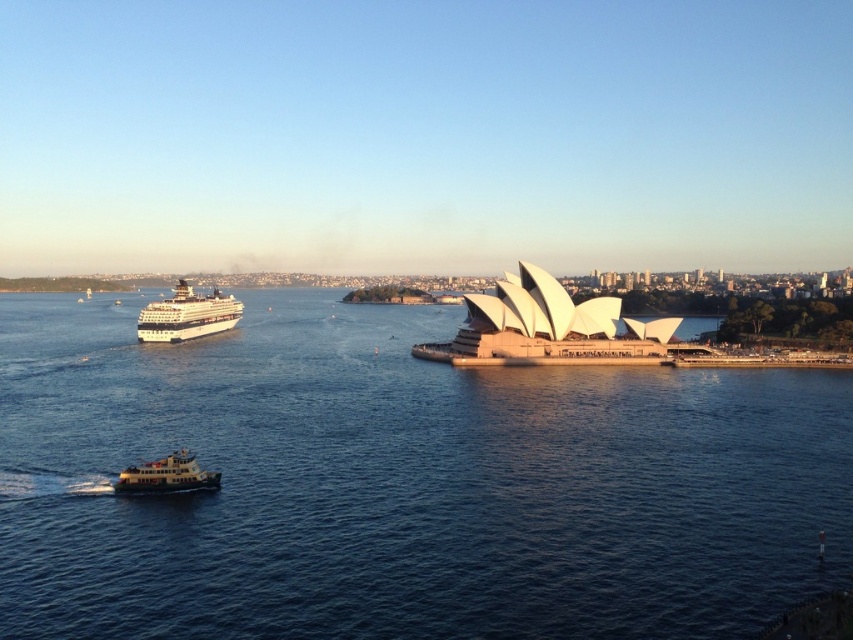
You are standing at the edge of Sydney Harbour, facing the iconic Sydney Opera House on the right. You notice a point marked at coordinates (x=389, y=426) in the scene. If you want to reach that point quickly, should you walk towards the Sydney Opera House on the right or towards the cruise ship on the left?

The point at coordinates (x=389, y=426) is 77.77 meters away from the viewer. Since the Sydney Opera House on the right is closer to the viewer than the cruise ship on the left, you should walk towards the Sydney Opera House on the right to reach the point more quickly.

You are a photographer planning to capture the Sydney Opera House and the ferry in the same frame. Based on the scene, which object is positioned closer to you, the blue water at center or the white matte ferry at lower left?

The blue water at center is closer to the viewer than the white matte ferry at lower left.

From the picture: You are a tourist standing at the shore near the Sydney Opera House. You see the white glossy cruise ship at left. In which direction should you look to see it?

The white glossy cruise ship at left is located at point (187, 316), which corresponds to the left side of the image. Therefore, you should look to your left to see it.